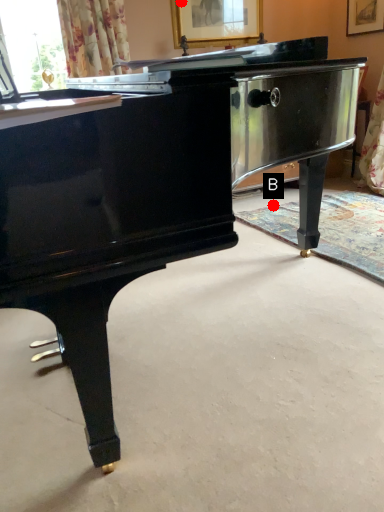
Question: Two points are circled on the image, labeled by A and B beside each circle. Among these points, which one is farthest from the camera?

Choices:
 (A) A is further
 (B) B is further

Answer: (B)